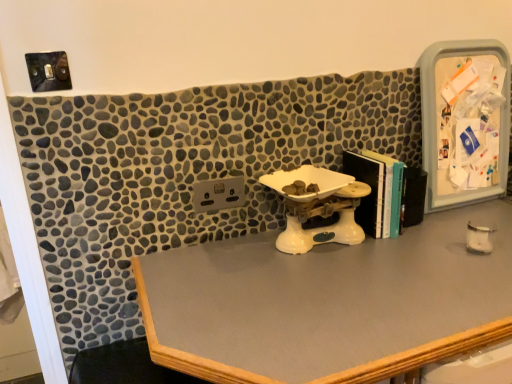
The height and width of the screenshot is (384, 512). What are the coordinates of `vacant space to the right of hardcover books at center-right` in the screenshot? It's located at (438, 226).